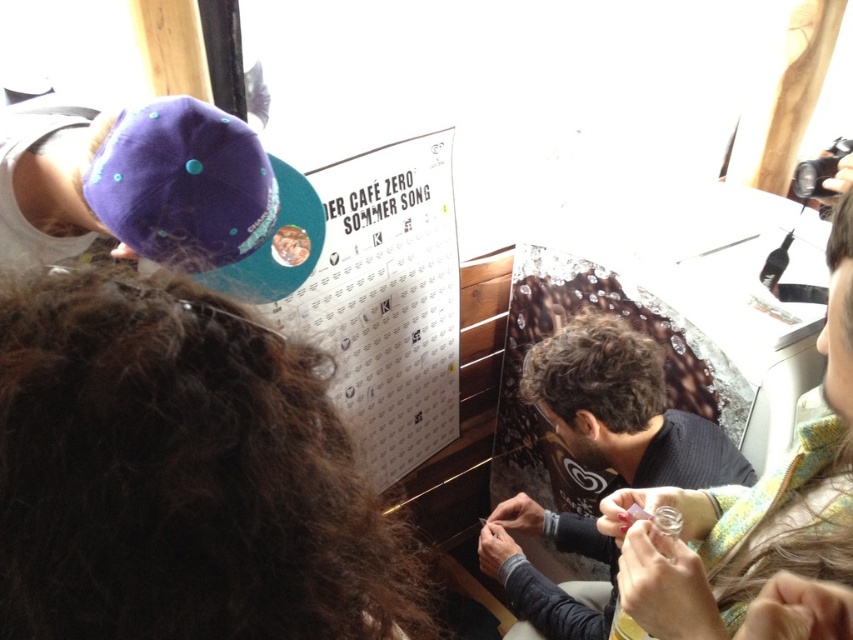
Question: Considering the relative positions of brown fuzzy hair at upper left and green fabric scarf at lower right in the image provided, where is brown fuzzy hair at upper left located with respect to green fabric scarf at lower right?

Choices:
 (A) above
 (B) below

Answer: (B)

Question: Is brown fuzzy hair at upper left to the right of dark gray sweater at center from the viewer's perspective?

Choices:
 (A) yes
 (B) no

Answer: (B)

Question: Which of the following is the closest to the observer?

Choices:
 (A) green fabric scarf at lower right
 (B) dark gray sweater at center

Answer: (A)

Question: Estimate the real-world distances between objects in this image. Which object is closer to the green fabric scarf at lower right?

Choices:
 (A) dark gray sweater at center
 (B) brown fuzzy hair at upper left

Answer: (B)

Question: Which object is the farthest from the dark gray sweater at center?

Choices:
 (A) green fabric scarf at lower right
 (B) brown fuzzy hair at upper left

Answer: (B)

Question: Does brown fuzzy hair at upper left have a greater width compared to dark gray sweater at center?

Choices:
 (A) yes
 (B) no

Answer: (B)